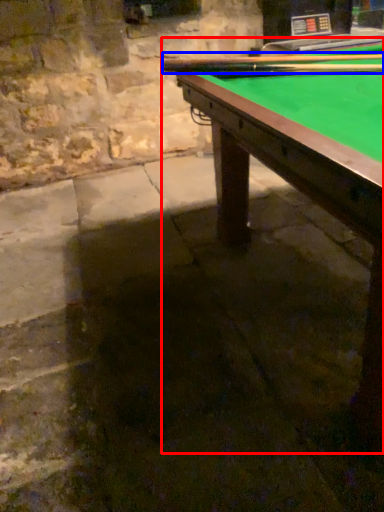
Question: Which object appears farthest to the camera in this image, billiard table (highlighted by a red box) or cue (highlighted by a blue box)?

Choices:
 (A) billiard table
 (B) cue

Answer: (B)